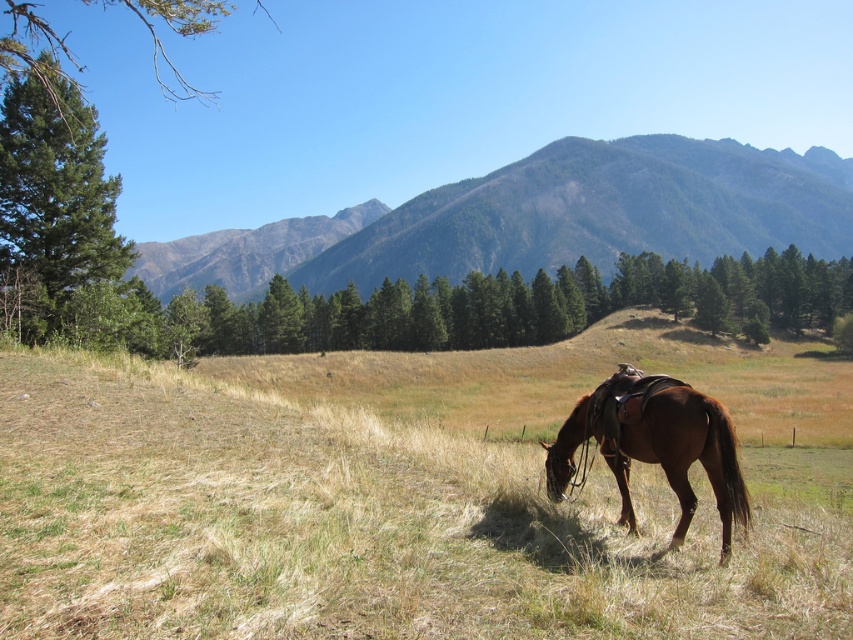
You are standing in the field and looking towards the mountains. Which object is closer to you, the green forested mountain at upper center or the brown glossy horse at lower center?

The brown glossy horse at lower center is closer to you because the green forested mountain at upper center is further away.

You are a photographer standing in the field. You want to take a photo of the brown glossy horse at lower center with the green textured pine tree at upper left in the background. Can you position yourself so that the pine tree appears behind the horse in the photo?

The green textured pine tree at upper left is positioned over the brown glossy horse at lower center, so yes, you can position yourself to have the pine tree appear behind the horse in the photo.